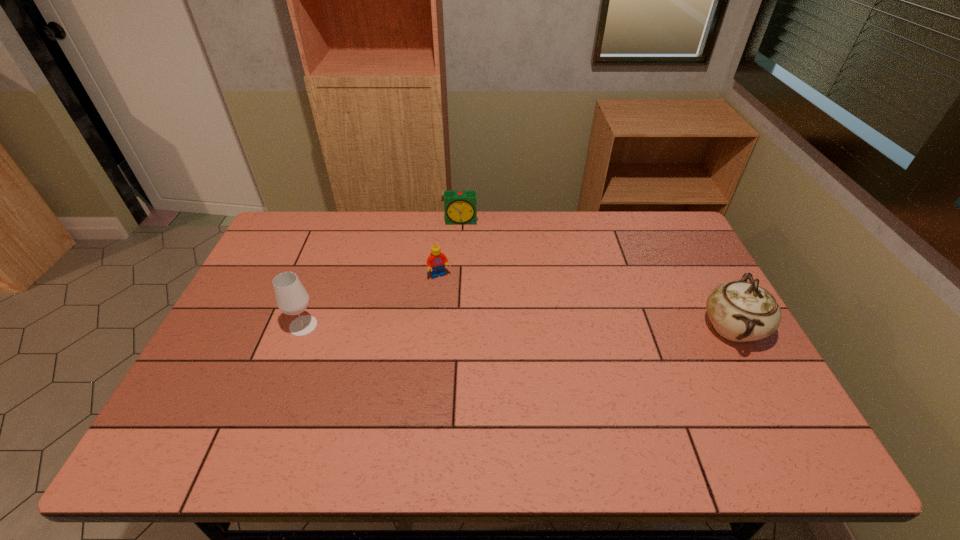
What are the coordinates of `free region at the near right corner of the desktop` in the screenshot? It's located at (726, 417).

What are the coordinates of `free point between the chinaware and the glass` in the screenshot? It's located at (517, 327).

The width and height of the screenshot is (960, 540). Identify the location of free space between the rightmost object and the third nearest object. click(x=586, y=302).

The width and height of the screenshot is (960, 540). In order to click on vacant area that lies between the farthest object and the third nearest object in this screenshot , I will do `click(450, 249)`.

The width and height of the screenshot is (960, 540). I want to click on free spot between the glass and the alarm clock, so pyautogui.click(x=382, y=273).

Identify the location of free spot between the glass and the Lego. The height and width of the screenshot is (540, 960). (372, 301).

The height and width of the screenshot is (540, 960). In order to click on free space between the leftmost object and the chinaware in this screenshot , I will do `click(517, 327)`.

The image size is (960, 540). Identify the location of free space between the farthest object and the chinaware. (597, 275).

Identify the location of free space that is in between the leftmost object and the rightmost object. (517, 327).

This screenshot has height=540, width=960. Find the location of `vacant space that's between the chinaware and the alarm clock`. vacant space that's between the chinaware and the alarm clock is located at coordinates (597, 275).